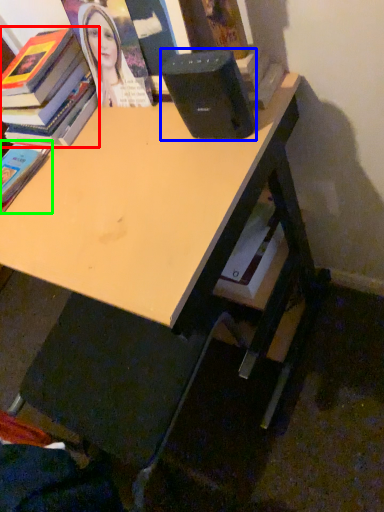
Question: Which object is the farthest from book (highlighted by a red box)? Choose among these: speaker (highlighted by a blue box) or book (highlighted by a green box).

Choices:
 (A) speaker
 (B) book

Answer: (A)